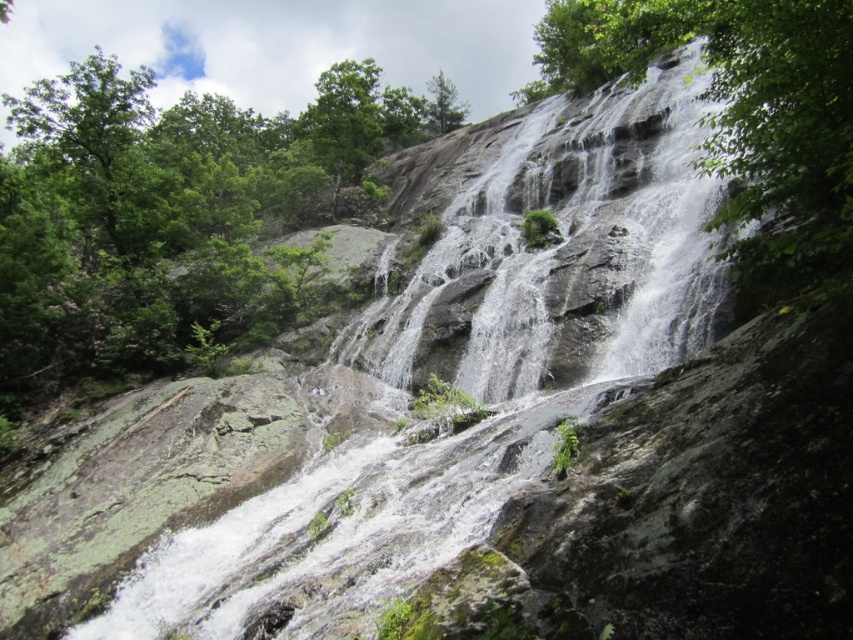
Question: Is green leafy tree at upper left bigger than green leafy tree at upper center?

Choices:
 (A) yes
 (B) no

Answer: (A)

Question: Where is green leafy tree at upper left located in relation to gray rock waterfall at center in the image?

Choices:
 (A) above
 (B) below

Answer: (A)

Question: Which point is closer to the camera taking this photo?

Choices:
 (A) (836, 8)
 (B) (157, 352)
 (C) (451, 99)
 (D) (531, 300)

Answer: (A)

Question: Which of the following is the farthest from the observer?

Choices:
 (A) (392, 392)
 (B) (160, 152)
 (C) (578, 22)
 (D) (437, 86)

Answer: (D)

Question: Can you confirm if green leafy tree at upper left is thinner than gray rock waterfall at center?

Choices:
 (A) yes
 (B) no

Answer: (B)

Question: Which of the following is the closest to the observer?

Choices:
 (A) (705, 200)
 (B) (431, 104)

Answer: (A)